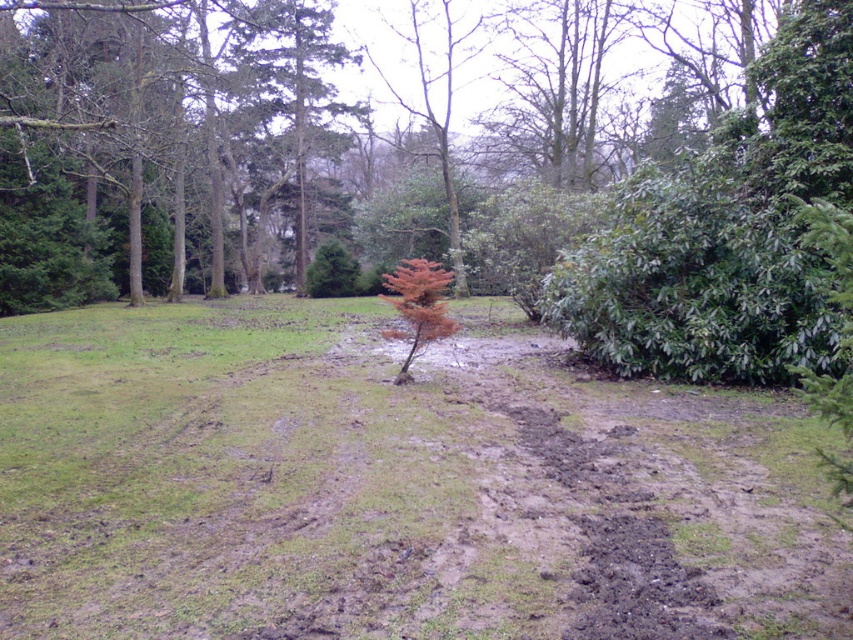
You are a hiker trying to navigate through the green grass at center and the brown textured tree at upper center. Which one is taller and would block your view more?

The brown textured tree at upper center is taller than the green grass at center, so it would block your view more.

You are standing at the point labeled as point (392, 484) in the image. What type of terrain are you currently standing on?

The point (392, 484) corresponds to green grass at center.

You are a hiker who needs to cross from the green grass at center to the brown textured tree at upper center. Given that your average walking pace is 1.5 meters per second, how many seconds will it take you to reach the tree?

The distance between the green grass at center and the brown textured tree at upper center is 27.89 meters. At a pace of 1.5 meters per second, it would take approximately 18.59 seconds to reach the tree.